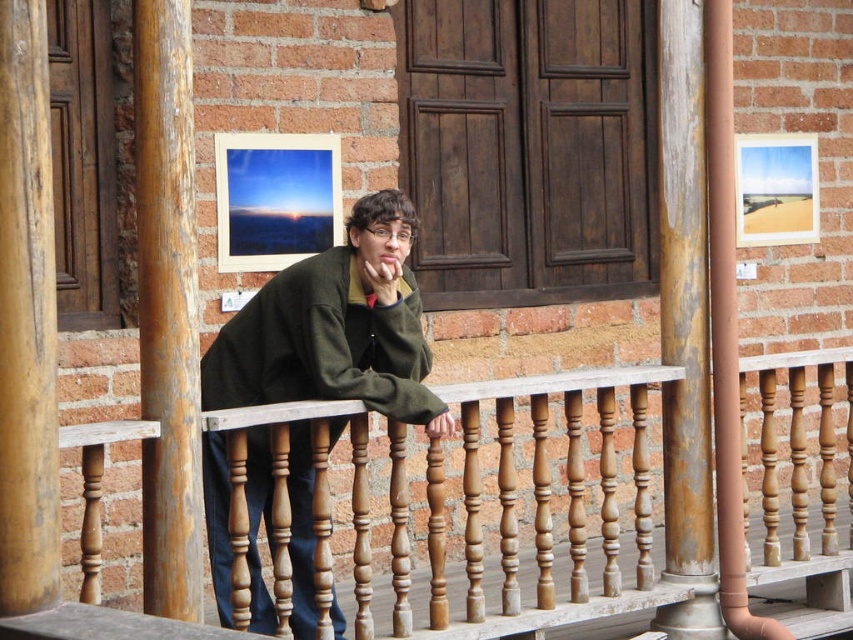
Question: Is wooden at center closer to the viewer compared to green fleece jacket at center?

Choices:
 (A) yes
 (B) no

Answer: (B)

Question: Which point is farther to the camera?

Choices:
 (A) (343, 253)
 (B) (271, 376)

Answer: (A)

Question: Which object appears farthest from the camera in this image?

Choices:
 (A) wooden at center
 (B) rusty wood post at center

Answer: (B)

Question: Among these objects, which one is nearest to the camera?

Choices:
 (A) rusty wood post at center
 (B) green matte jacket at center
 (C) wooden at center

Answer: (B)

Question: Does green matte jacket at center appear over rusty wood post at center?

Choices:
 (A) no
 (B) yes

Answer: (A)

Question: Does wooden at center appear on the right side of green matte jacket at center?

Choices:
 (A) yes
 (B) no

Answer: (A)